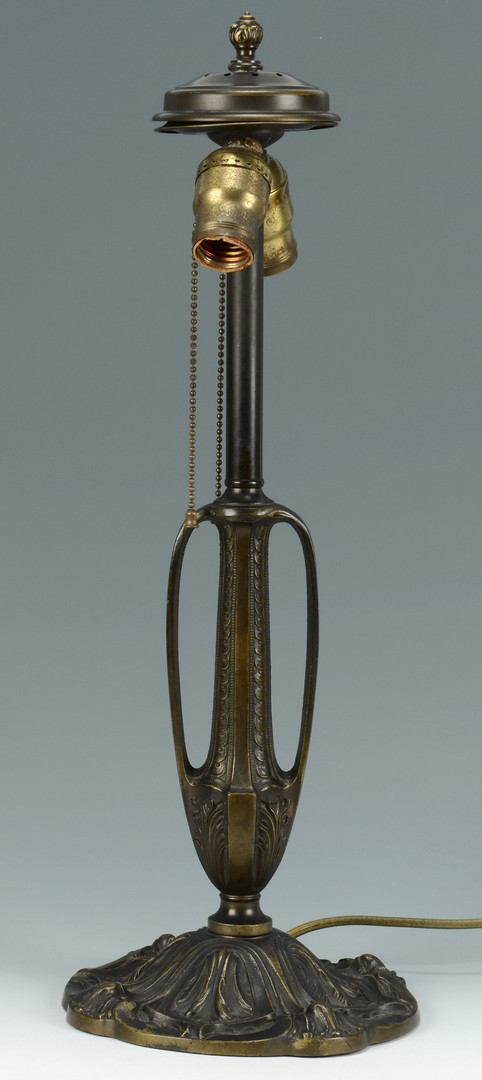
Where is `knob`? The height and width of the screenshot is (1080, 482). knob is located at coordinates (254, 37).